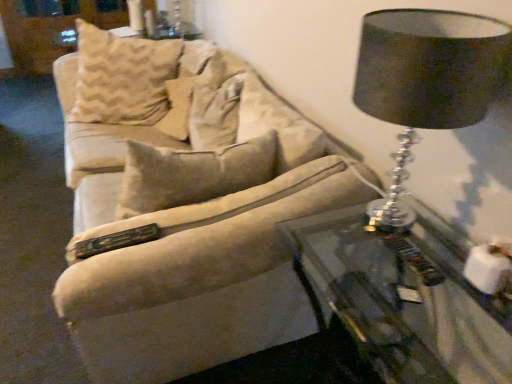
Question: In terms of size, does beige fabric pillow at center appear bigger or smaller than black fabric lampshade at upper right?

Choices:
 (A) small
 (B) big

Answer: (B)

Question: From the image's perspective, relative to black fabric lampshade at upper right, is beige fabric pillow at center above or below?

Choices:
 (A) above
 (B) below

Answer: (A)

Question: Which is nearer to the transparent glass table at lower right?

Choices:
 (A) white fabric dresser at upper left
 (B) black fabric lampshade at upper right
 (C) beige fabric pillow at center

Answer: (B)

Question: Which object is positioned farthest from the black fabric lampshade at upper right?

Choices:
 (A) beige fabric pillow at center
 (B) white fabric dresser at upper left
 (C) transparent glass table at lower right

Answer: (B)